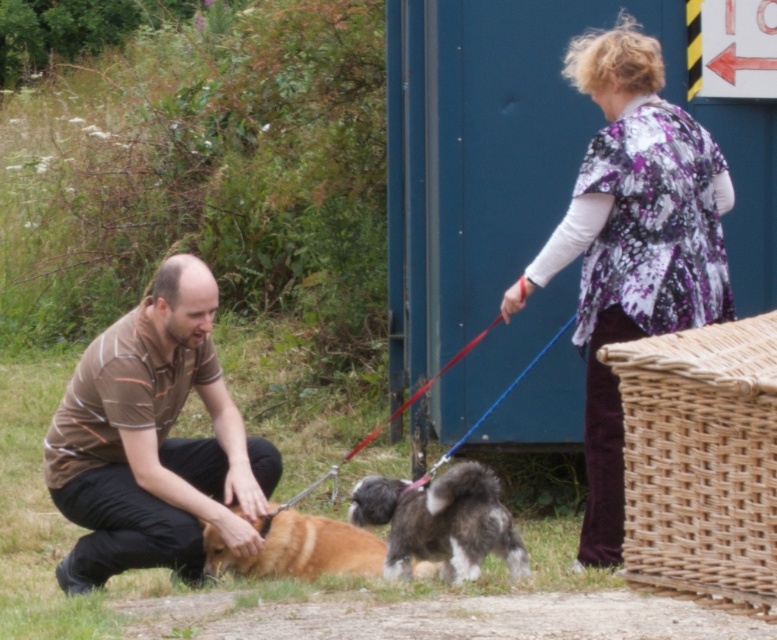
Question: Is brown striped shirt at lower left below fluffy gray dog at center?

Choices:
 (A) no
 (B) yes

Answer: (A)

Question: Among these objects, which one is nearest to the camera?

Choices:
 (A) brown striped shirt at lower left
 (B) fluffy gray dog at center
 (C) floral-patterned fabric at upper right
 (D) golden fur dog at center

Answer: (B)

Question: Based on their relative distances, which object is farther from the fluffy gray dog at center?

Choices:
 (A) brown striped shirt at lower left
 (B) golden fur dog at center
 (C) floral-patterned fabric at upper right

Answer: (C)

Question: Estimate the real-world distances between objects in this image. Which object is closer to the brown striped shirt at lower left?

Choices:
 (A) golden fur dog at center
 (B) fluffy gray dog at center
 (C) floral-patterned fabric at upper right

Answer: (A)

Question: Is floral-patterned fabric at upper right below golden fur dog at center?

Choices:
 (A) no
 (B) yes

Answer: (A)

Question: Is floral-patterned fabric at upper right to the right of golden fur dog at center from the viewer's perspective?

Choices:
 (A) no
 (B) yes

Answer: (B)